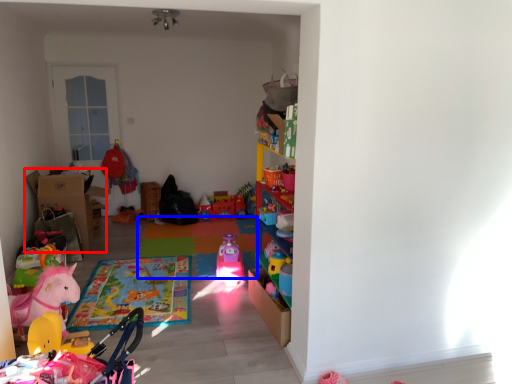
Question: Which object appears closest to the camera in this image, cardboard box (highlighted by a red box) or plain (highlighted by a blue box)?

Choices:
 (A) cardboard box
 (B) plain

Answer: (B)